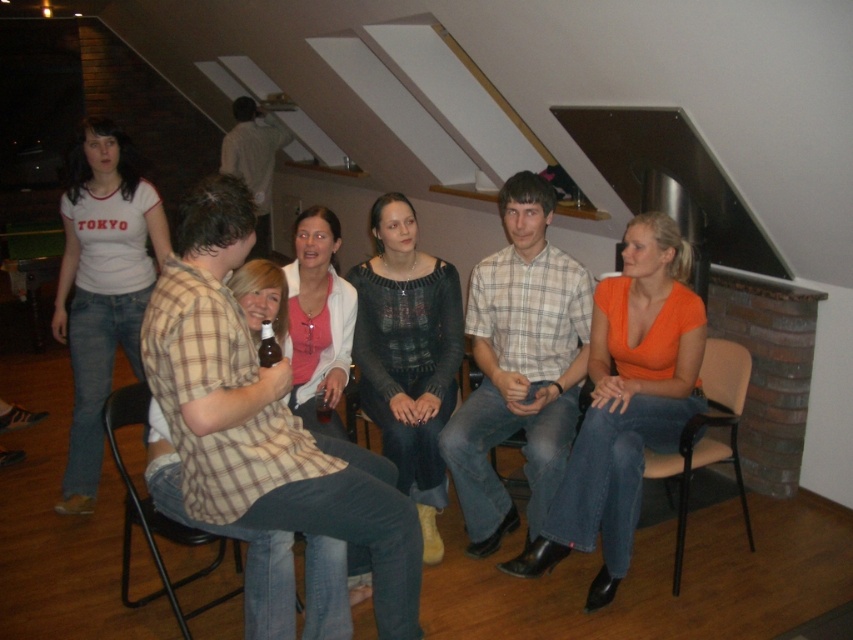
Question: Among these objects, which one is nearest to the camera?

Choices:
 (A) orange matte shirt at center
 (B) black plastic chair at lower left

Answer: (B)

Question: Can you confirm if white matte shirt at left is thinner than light brown shirt at upper center?

Choices:
 (A) yes
 (B) no

Answer: (A)

Question: Estimate the real-world distances between objects in this image. Which object is closer to the knitted sweater at center?

Choices:
 (A) orange matte shirt at center
 (B) light brown shirt at upper center

Answer: (A)

Question: Which point is closer to the camera taking this photo?

Choices:
 (A) (234, 481)
 (B) (712, 412)

Answer: (A)

Question: From the image, what is the correct spatial relationship of plaid cotton shirt at center in relation to white matte shirt at left?

Choices:
 (A) left
 (B) right

Answer: (B)

Question: Can you confirm if white matte shirt at left is positioned to the right of matte pink sweater at center?

Choices:
 (A) no
 (B) yes

Answer: (A)